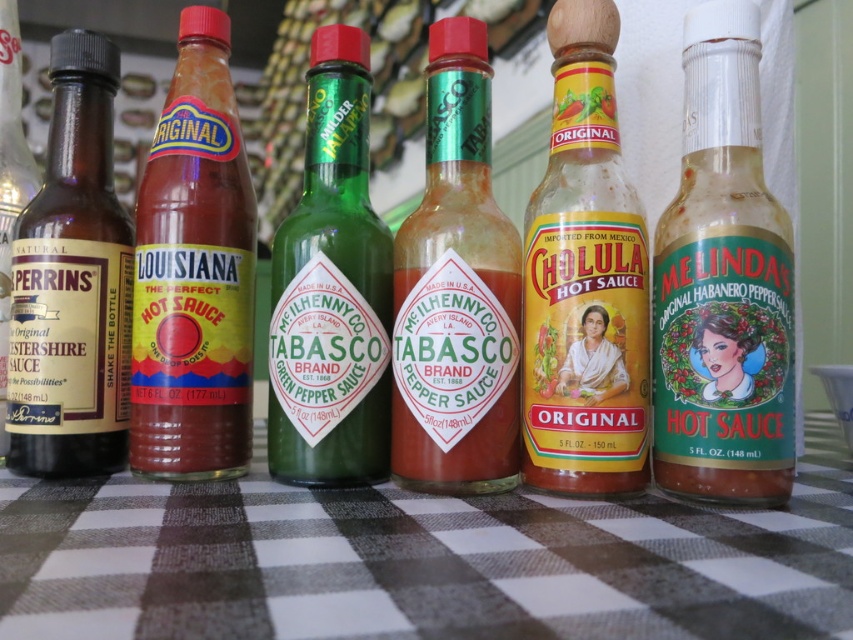
Is matte glass bottle at center taller than matte plastic hot sauce at center?

No.

Is matte glass bottle at center closer to the viewer compared to matte plastic hot sauce at center?

Yes.

Between point (729, 294) and point (239, 458), which one is positioned in front?

Positioned in front is point (729, 294).

Image resolution: width=853 pixels, height=640 pixels. Find the location of `matte glass bottle at center`. matte glass bottle at center is located at coordinates tap(723, 284).

Is black checkered tablecloth at center wider than matte plastic hot sauce at center?

Indeed, black checkered tablecloth at center has a greater width compared to matte plastic hot sauce at center.

Between black checkered tablecloth at center and matte plastic hot sauce at center, which one is positioned lower?

black checkered tablecloth at center

Find the location of a particular element. This screenshot has height=640, width=853. black checkered tablecloth at center is located at coordinates (421, 561).

Does green glass tabasco bottle at center appear on the right side of brown glass bottle at left?

Indeed, green glass tabasco bottle at center is positioned on the right side of brown glass bottle at left.

Is green glass tabasco bottle at center positioned before brown glass bottle at left?

Yes.

Is point (318, 198) positioned after point (44, 173)?

No, (318, 198) is in front of (44, 173).

Locate an element on the screen. green glass tabasco bottle at center is located at coordinates (331, 289).